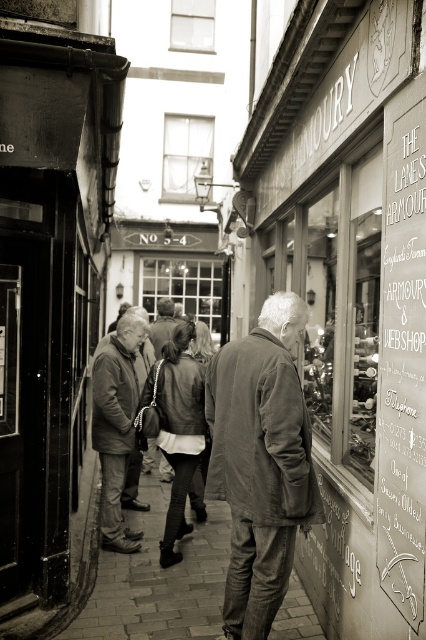
You are a customer standing in the street and want to read the white chalkboard sign at right. You are currently holding the matte brown jacket at center. Can you read the sign without moving closer?

The white chalkboard sign at right is 10.91 feet away from matte brown jacket at center. Since you are holding the jacket at center, you are 10.91 feet away from the sign. Whether you can read it depends on your eyesight, but the distance is about 3.3 yards. If you have normal vision, you might be able to read it, but moving closer would make it easier.